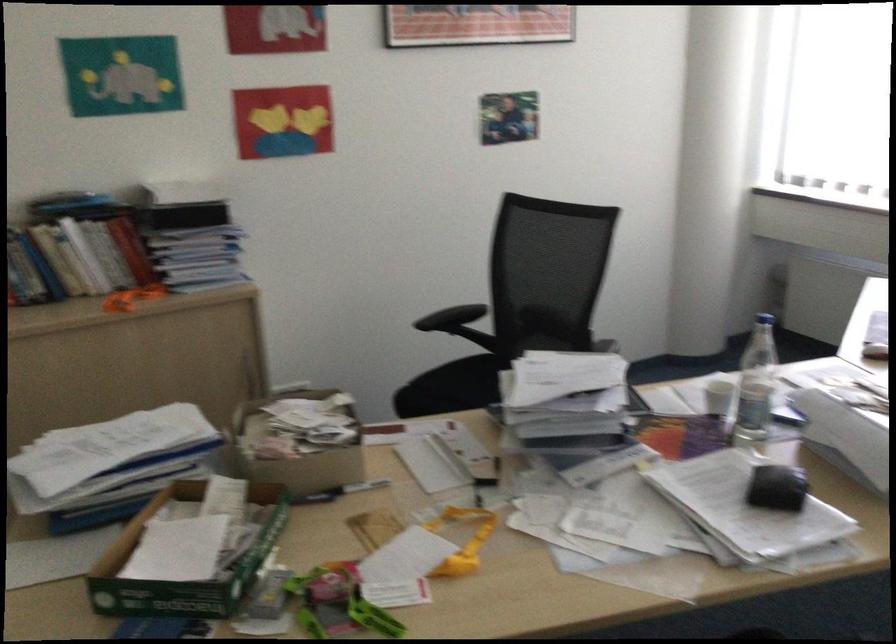
Identify the location of clear water bottle. (755, 386).